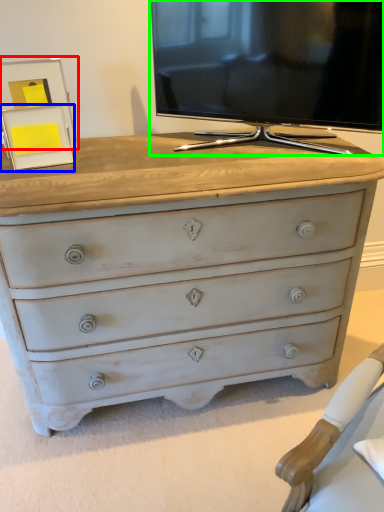
Question: Which is nearer to the picture frame (highlighted by a red box)? picture frame (highlighted by a blue box) or television (highlighted by a green box).

Choices:
 (A) picture frame
 (B) television

Answer: (A)